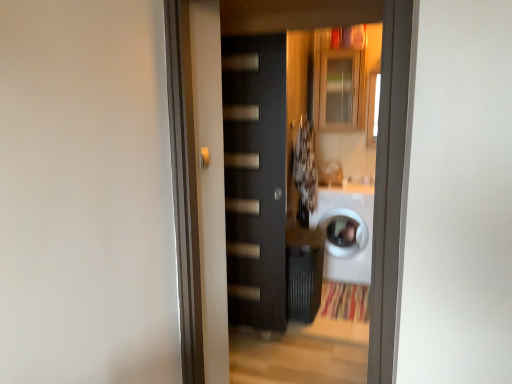
Question: Is matte black door at center bigger or smaller than matte glass cabinet at upper center?

Choices:
 (A) big
 (B) small

Answer: (A)

Question: From a real-world perspective, is matte black door at center physically located above or below matte glass cabinet at upper center?

Choices:
 (A) below
 (B) above

Answer: (A)

Question: Estimate the real-world distances between objects in this image. Which object is farther from the white glossy washing machine at center?

Choices:
 (A) matte black door at center
 (B) matte glass cabinet at upper center
 (C) fluffy white laundry at center
 (D) matte black door handle at center

Answer: (D)

Question: Which object is positioned closest to the fluffy white laundry at center?

Choices:
 (A) matte black door at center
 (B) matte glass cabinet at upper center
 (C) matte black door handle at center
 (D) white glossy washing machine at center

Answer: (D)